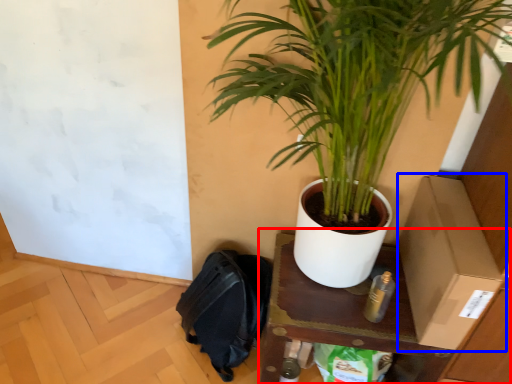
Question: Which of the following is the closest to the observer, table (highlighted by a red box) or cardboard box (highlighted by a blue box)?

Choices:
 (A) table
 (B) cardboard box

Answer: (B)